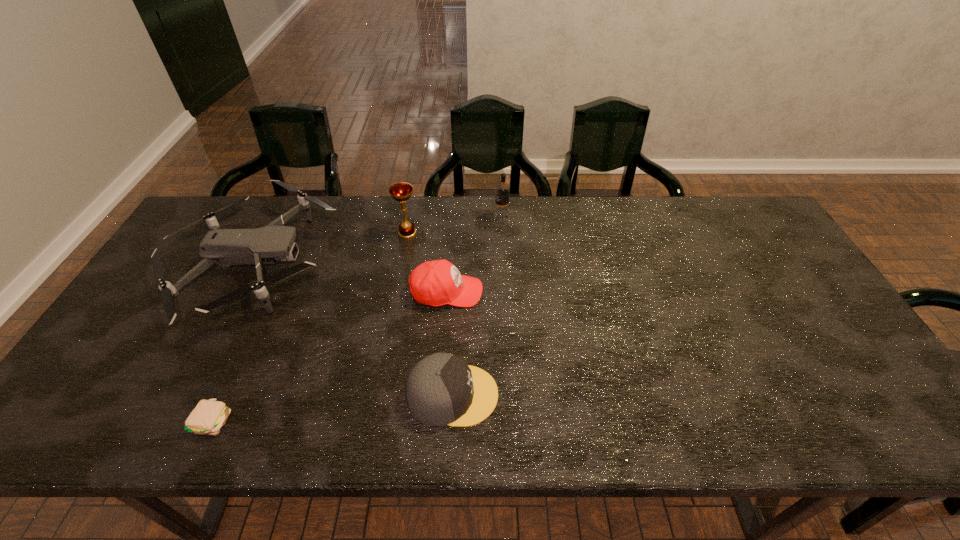
Identify the location of free space between the vodka and the patty. Image resolution: width=960 pixels, height=540 pixels. (357, 319).

At what (x,y) coordinates should I click in order to perform the action: click on empty space that is in between the drone and the cap. Please return your answer as a coordinate pair (x, y). Looking at the image, I should click on click(353, 329).

Find the location of a particular element. The width and height of the screenshot is (960, 540). blank region between the vodka and the chalice is located at coordinates (454, 225).

Locate an element on the screen. The height and width of the screenshot is (540, 960). unoccupied area between the patty and the cap is located at coordinates (333, 408).

Identify the location of empty space that is in between the shortest object and the rightmost object. (x=357, y=319).

Point out which object is positioned as the nearest to the patty. Please provide its 2D coordinates. Your answer should be formatted as a tuple, i.e. [(x, y)], where the tuple contains the x and y coordinates of a point satisfying the conditions above.

[(224, 247)]

Where is `the closest object to the baseball cap`? This screenshot has width=960, height=540. the closest object to the baseball cap is located at coordinates (402, 191).

The image size is (960, 540). I want to click on free spot that satisfies the following two spatial constraints: 1. on the front-facing side of the drone; 2. on the left side of the shortest object, so click(x=173, y=421).

Find the location of a particular element. blank space that satisfies the following two spatial constraints: 1. on the front-facing side of the drone; 2. on the back side of the patty is located at coordinates (173, 421).